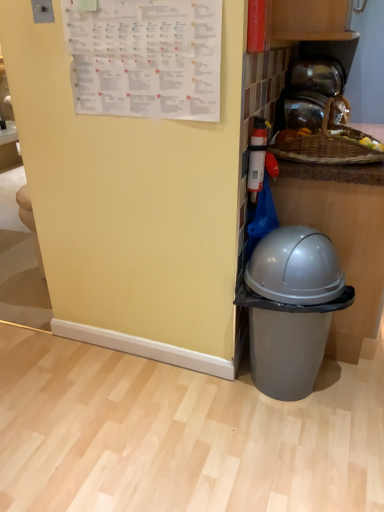
Question: From a real-world perspective, is woven wood basket at upper right above or below transparent glass jar at upper right?

Choices:
 (A) above
 (B) below

Answer: (B)

Question: Is point (304, 167) closer or farther from the camera than point (289, 108)?

Choices:
 (A) farther
 (B) closer

Answer: (B)

Question: Which of these objects is positioned farthest from the white paper calendar at upper left?

Choices:
 (A) transparent glass jar at upper right
 (B) gray plastic trash can at lower right
 (C) woven wood basket at upper right

Answer: (B)

Question: Based on their relative distances, which object is farther from the woven wood basket at upper right?

Choices:
 (A) gray plastic trash can at lower right
 (B) white paper calendar at upper left
 (C) transparent glass jar at upper right

Answer: (B)